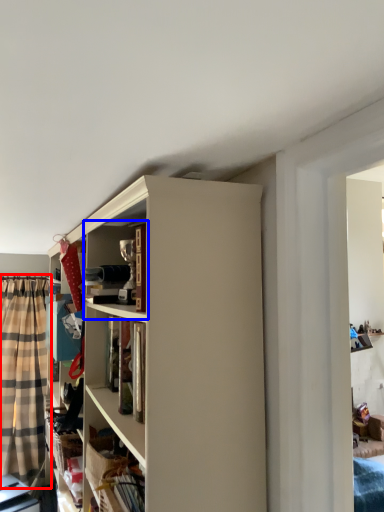
Question: Which object is further to the camera taking this photo, curtain (highlighted by a red box) or cabinet (highlighted by a blue box)?

Choices:
 (A) curtain
 (B) cabinet

Answer: (A)